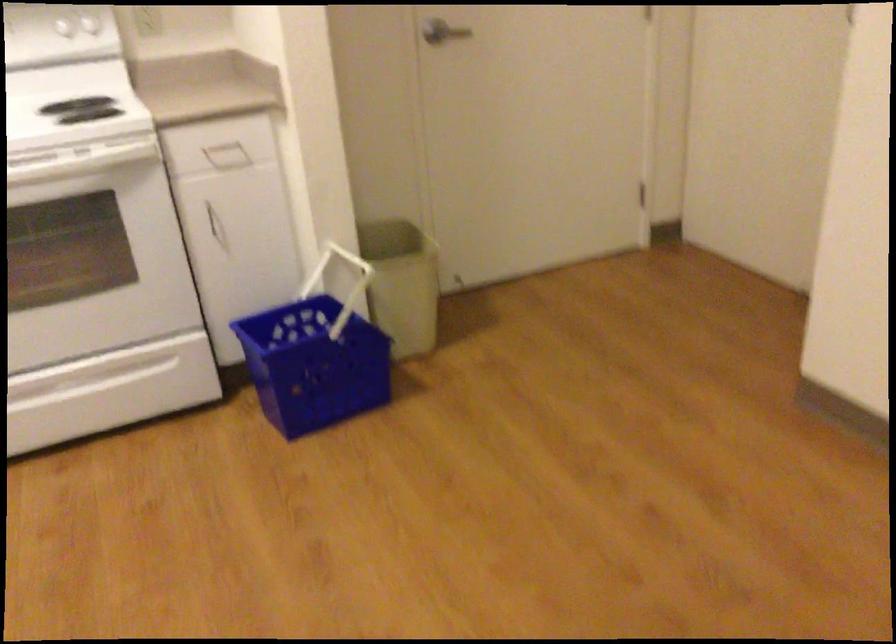
Where would you pull the white cabinet handle? Please return your answer as a coordinate pair (x, y).

(227, 156)